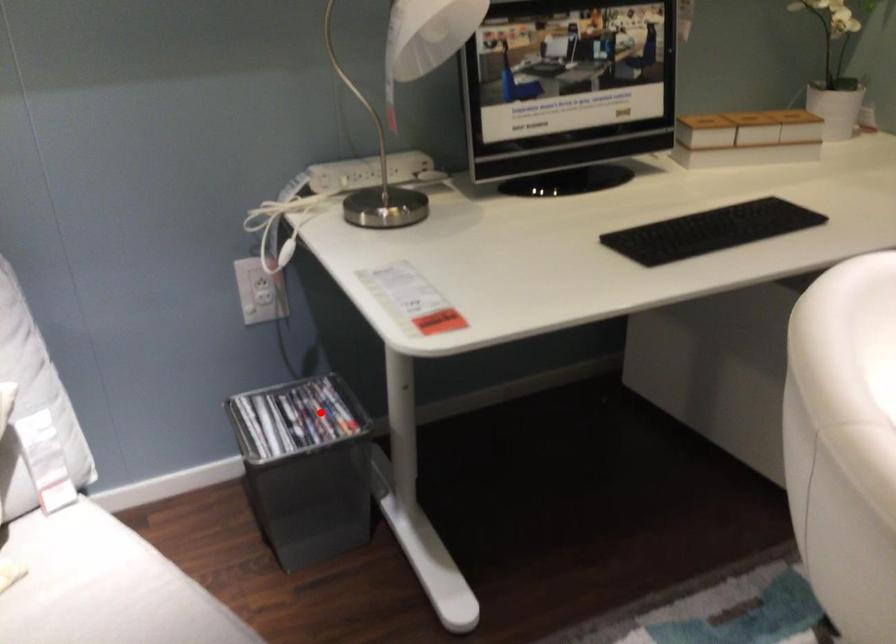
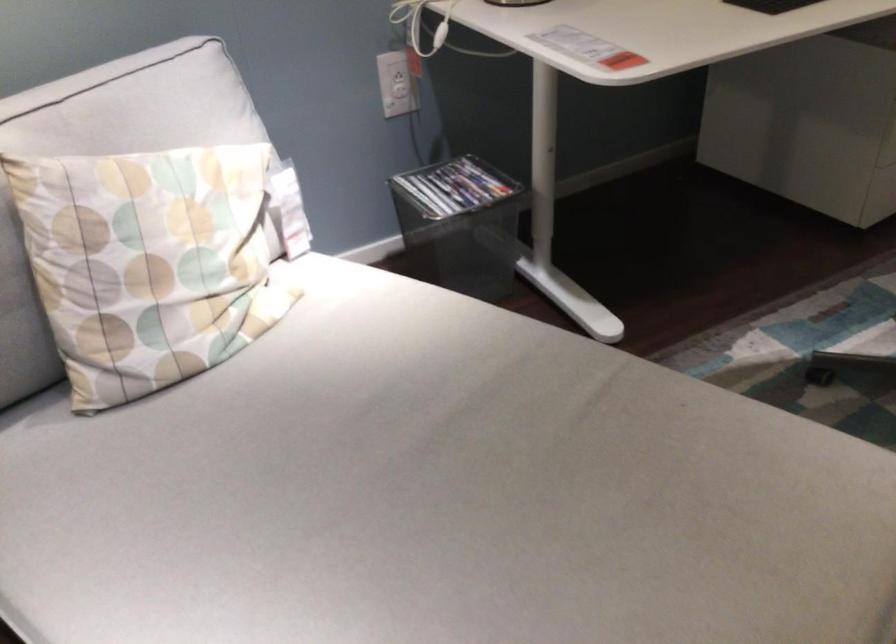
Where in the second image is the point corresponding to the highlighted location from the first image?

(454, 187)